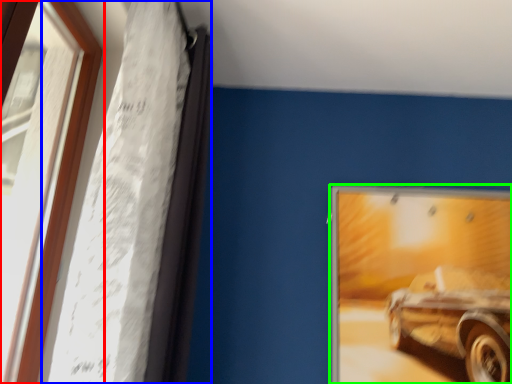
Question: Considering the real-world distances, which object is closest to window (highlighted by a red box)? curtain (highlighted by a blue box) or picture frame (highlighted by a green box).

Choices:
 (A) curtain
 (B) picture frame

Answer: (A)